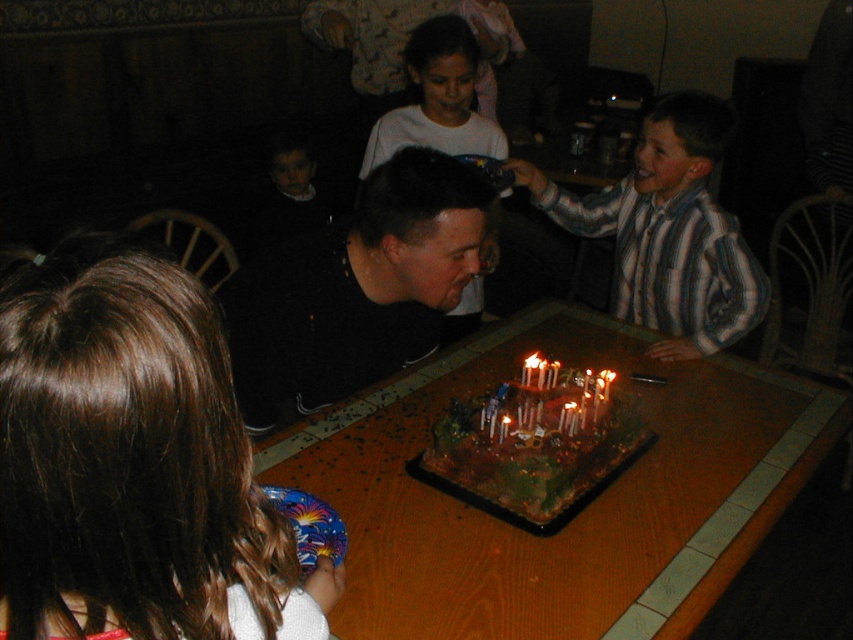
Question: Which point is farther to the camera?

Choices:
 (A) (424, 488)
 (B) (498, 433)

Answer: (B)

Question: Does wooden table at center have a smaller size compared to white wax candles at center?

Choices:
 (A) yes
 (B) no

Answer: (B)

Question: Which is nearer to the white matte shirt at center?

Choices:
 (A) striped cotton shirt at right
 (B) wooden table at center
 (C) white wax candles at center
 (D) chocolate frosted cake with candles at center

Answer: (A)

Question: Can you confirm if striped cotton shirt at right is positioned above white wax candles at center?

Choices:
 (A) yes
 (B) no

Answer: (A)

Question: Considering the relative positions of black matte shirt at center and chocolate frosted cake with candles at center in the image provided, where is black matte shirt at center located with respect to chocolate frosted cake with candles at center?

Choices:
 (A) left
 (B) right

Answer: (A)

Question: Which point is farther to the camera?

Choices:
 (A) (7, 566)
 (B) (722, 240)

Answer: (B)